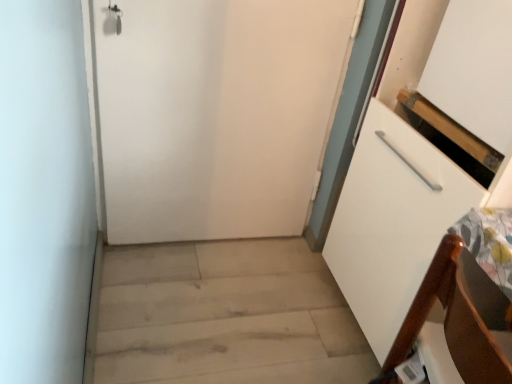
Question: From the image's perspective, is light wood floor at lower left above white matte door at center?

Choices:
 (A) no
 (B) yes

Answer: (A)

Question: From the image's perspective, would you say light wood floor at lower left is shown under white matte door at center?

Choices:
 (A) no
 (B) yes

Answer: (B)

Question: Is light wood floor at lower left not close to white matte door at center?

Choices:
 (A) no
 (B) yes

Answer: (A)

Question: Is light wood floor at lower left in front of white matte door at center?

Choices:
 (A) yes
 (B) no

Answer: (A)

Question: Is light wood floor at lower left aimed at white matte door at center?

Choices:
 (A) no
 (B) yes

Answer: (A)

Question: In terms of size, does white matte door at center appear bigger or smaller than brown wood chair at lower right?

Choices:
 (A) big
 (B) small

Answer: (A)

Question: Considering the positions of white matte door at center and brown wood chair at lower right in the image, is white matte door at center wider or thinner than brown wood chair at lower right?

Choices:
 (A) wide
 (B) thin

Answer: (B)

Question: Considering their positions, is white matte door at center located in front of or behind brown wood chair at lower right?

Choices:
 (A) front
 (B) behind

Answer: (B)

Question: From the image's perspective, is white matte door at center positioned above or below brown wood chair at lower right?

Choices:
 (A) below
 (B) above

Answer: (B)

Question: Considering the positions of point (441, 314) and point (151, 104), is point (441, 314) closer or farther from the camera than point (151, 104)?

Choices:
 (A) farther
 (B) closer

Answer: (B)

Question: In terms of width, does brown wood chair at lower right look wider or thinner when compared to white matte door at center?

Choices:
 (A) thin
 (B) wide

Answer: (B)

Question: From a real-world perspective, is brown wood chair at lower right above or below white matte door at center?

Choices:
 (A) below
 (B) above

Answer: (B)

Question: From their relative heights in the image, would you say brown wood chair at lower right is taller or shorter than white matte door at center?

Choices:
 (A) short
 (B) tall

Answer: (A)

Question: From a real-world perspective, relative to white matte door at center, is light wood floor at lower left vertically above or below?

Choices:
 (A) above
 (B) below

Answer: (B)

Question: Considering the positions of point (340, 294) and point (211, 49), is point (340, 294) closer or farther from the camera than point (211, 49)?

Choices:
 (A) closer
 (B) farther

Answer: (B)